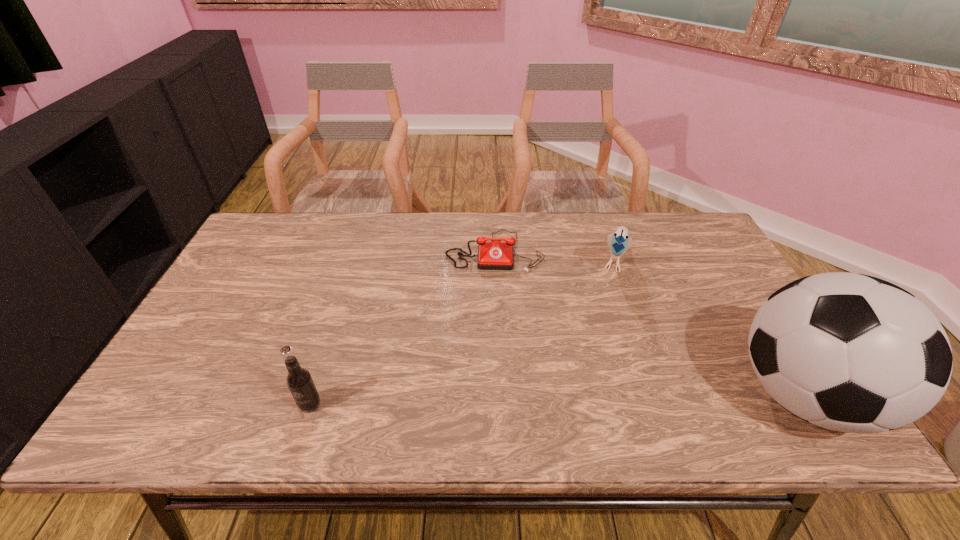
The image size is (960, 540). I want to click on free space on the desktop that is between the leftmost object and the tallest object and is positioned at the face of the bird, so click(582, 399).

The width and height of the screenshot is (960, 540). In order to click on vacant space on the desktop that is between the root beer and the tallest object and is positioned on the dial of the shortest object in this screenshot , I will do `click(492, 401)`.